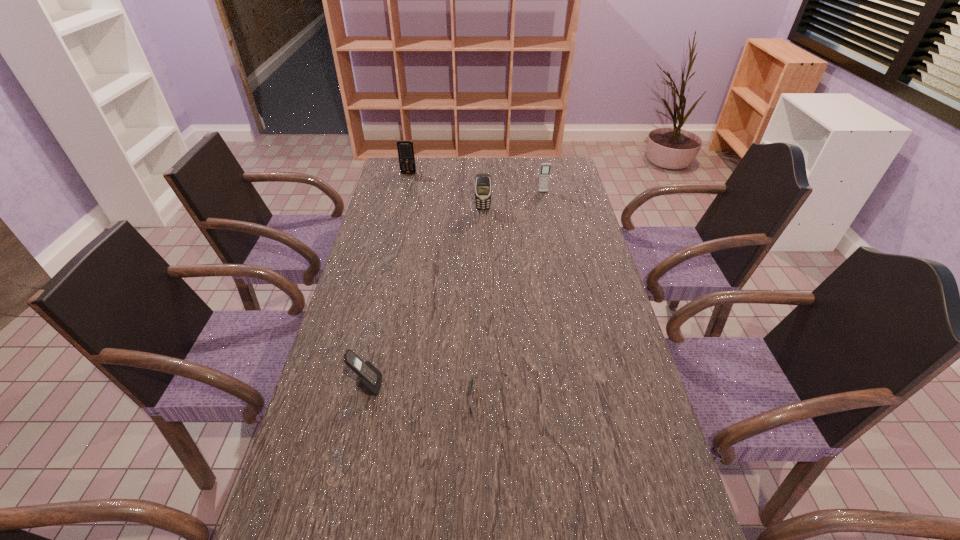
Identify the location of free region located on the front-facing side of the nearest cellular telephone. This screenshot has height=540, width=960. (459, 386).

Locate an element on the screen. free space located on the lenses of the shortest object is located at coordinates (440, 402).

Locate an element on the screen. free space located 0.350m on the lenses of the shortest object is located at coordinates (322, 402).

The width and height of the screenshot is (960, 540). Identify the location of vacant area situated on the lenses of the shortest object. (406, 402).

Image resolution: width=960 pixels, height=540 pixels. What are the coordinates of `object present at the far edge` in the screenshot? It's located at (405, 148).

Identify the location of object present at the right edge. (545, 167).

The image size is (960, 540). Find the location of `object located at the far left corner`. object located at the far left corner is located at coordinates (405, 148).

In order to click on free spot at the left edge of the desktop in this screenshot , I will do `click(371, 430)`.

You are a GUI agent. You are given a task and a screenshot of the screen. Output one action in this format:
    pyautogui.click(x=<x>, y=<y>)
    Task: Click on the vacant space at the right edge
    Image resolution: width=960 pixels, height=540 pixels.
    Given the screenshot: What is the action you would take?
    pyautogui.click(x=625, y=378)

Find the location of a particular element. This screenshot has width=960, height=540. free spot between the shortest object and the third farthest object is located at coordinates (487, 306).